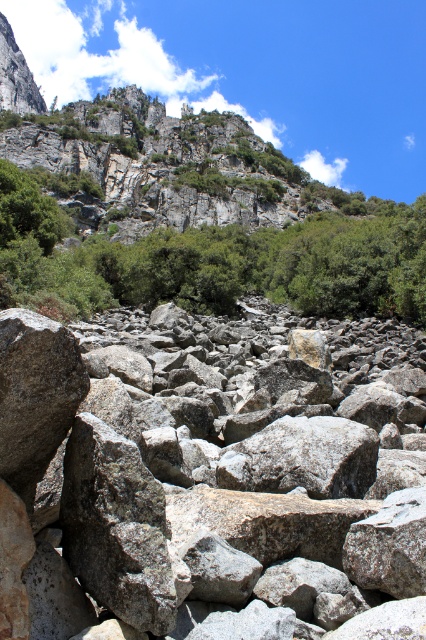
Is gray rock at center to the right of green leafy tree at upper center from the viewer's perspective?

No, gray rock at center is not to the right of green leafy tree at upper center.

Does point (339, 360) lie behind point (317, 298)?

No, (339, 360) is in front of (317, 298).

Is point (127, 618) behind point (325, 314)?

No.

Find the location of a particular element. The width and height of the screenshot is (426, 640). gray rock at center is located at coordinates (210, 480).